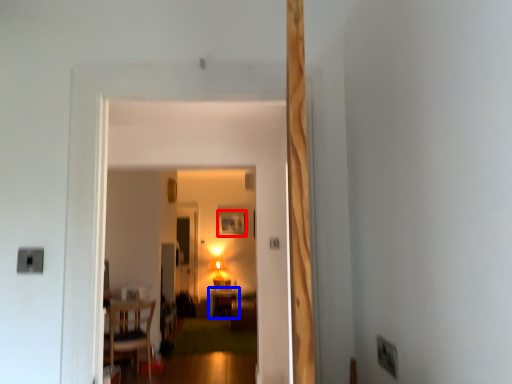
Question: Which object appears closest to the camera in this image, picture frame (highlighted by a red box) or table (highlighted by a blue box)?

Choices:
 (A) picture frame
 (B) table

Answer: (B)